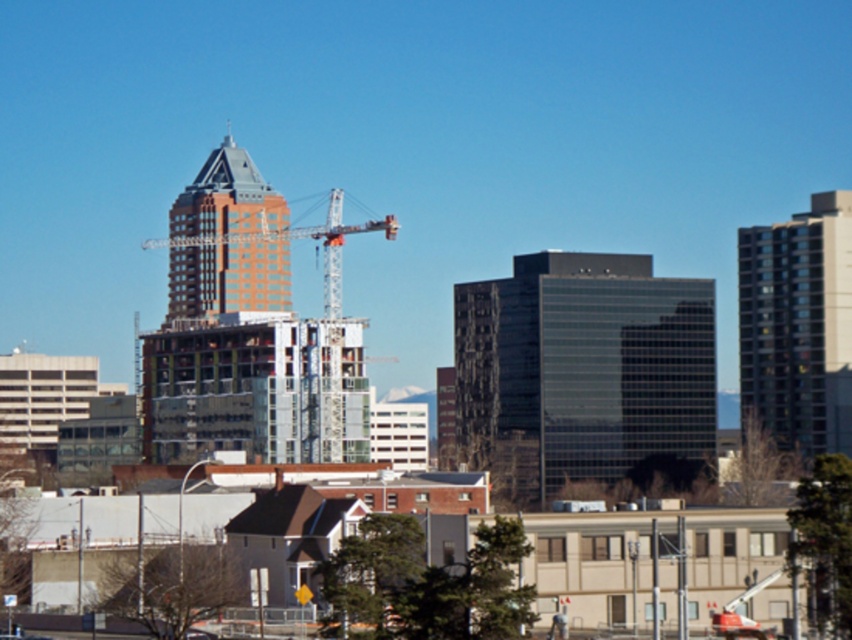
Which is more to the left, matte glass skyscraper at center or metallic silver crane at center?

matte glass skyscraper at center is more to the left.

Who is higher up, matte glass skyscraper at center or metallic silver crane at center?

Positioned higher is matte glass skyscraper at center.

Does point (272, 205) lie behind point (330, 230)?

Yes, it is.

Where is `matte glass skyscraper at center`? The image size is (852, 640). matte glass skyscraper at center is located at coordinates (227, 278).

Does black glass building at center have a greater height compared to matte glass skyscraper at center?

Yes, black glass building at center is taller than matte glass skyscraper at center.

Does black glass building at center come in front of matte glass skyscraper at center?

Yes, black glass building at center is closer to the viewer.

Describe the element at coordinates (580, 371) in the screenshot. I see `black glass building at center` at that location.

At what (x,y) coordinates should I click in order to perform the action: click on black glass building at center. Please return your answer as a coordinate pair (x, y). Looking at the image, I should click on (580, 371).

How distant is dark gray glass building at right from metallic silver crane at center?

dark gray glass building at right is 114.91 meters from metallic silver crane at center.

Between point (822, 396) and point (377, 228), which one is positioned in front?

Point (377, 228) is more forward.

You are a GUI agent. You are given a task and a screenshot of the screen. Output one action in this format:
    pyautogui.click(x=<x>, y=<y>)
    Task: Click on the dark gray glass building at right
    The image size is (852, 640).
    Given the screenshot: What is the action you would take?
    pyautogui.click(x=798, y=324)